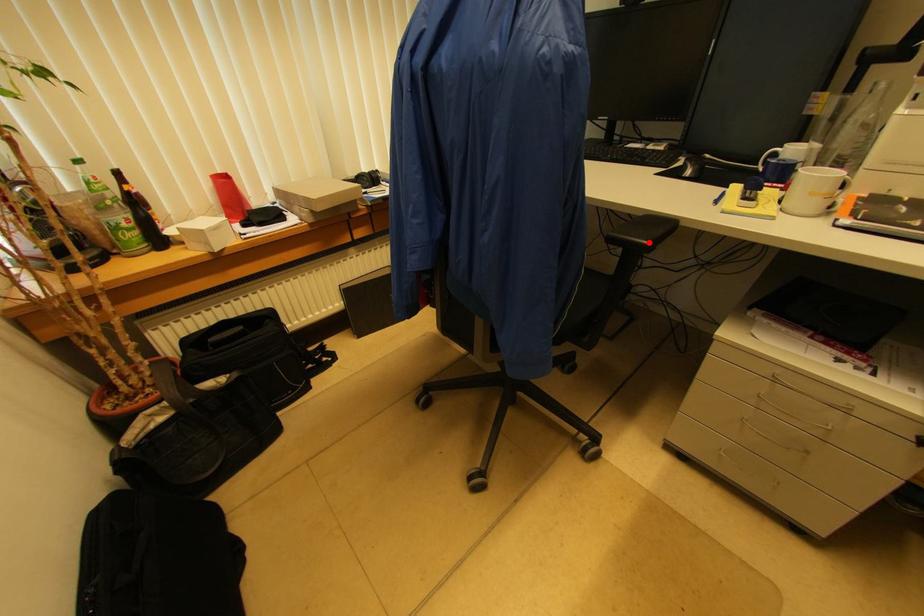
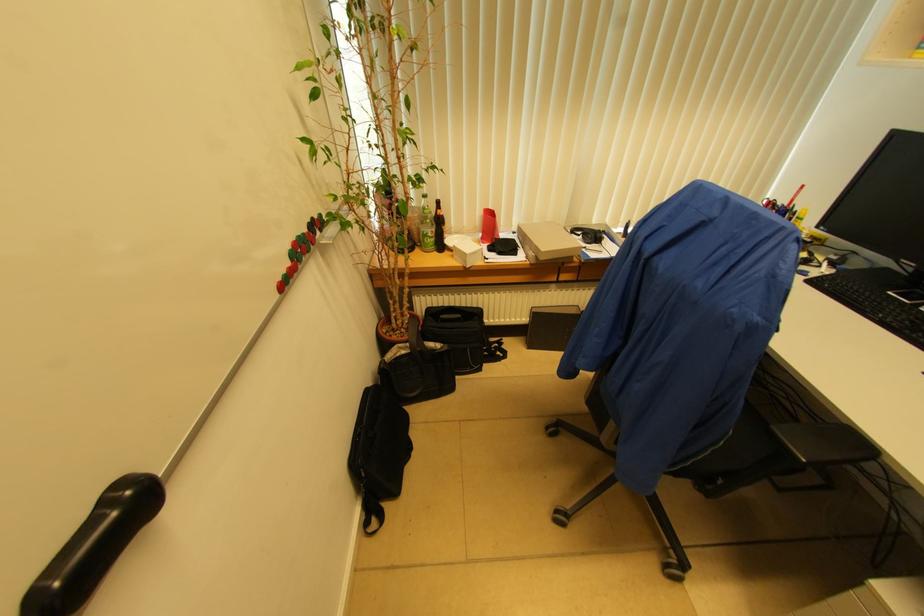
Question: I am providing you with two images of the same scene from different viewpoints. Given a red point in image1, look at the same physical point in image2. Is it:

Choices:
 (A) Closer to the viewpoint
 (B) Farther from the viewpoint

Answer: (A)